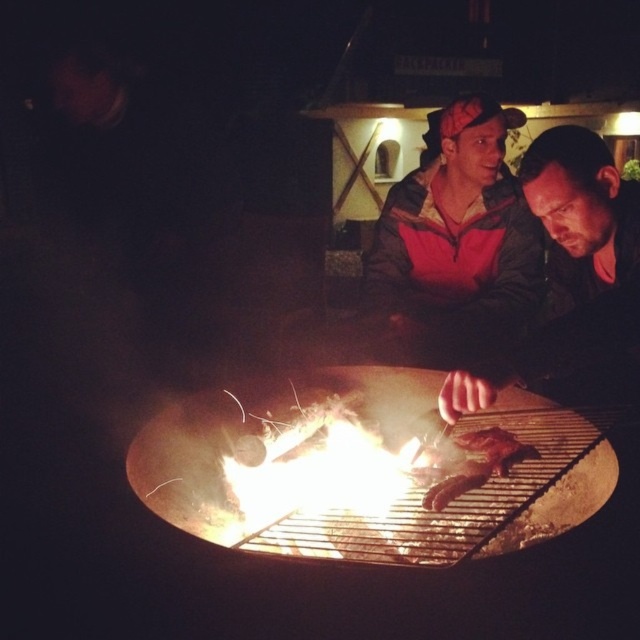
In the scene shown: You are standing near the fire pit and want to hand a marshmallow to the person in the camouflage jacket at center. Which side of the charred wood at grill center should you approach from to reach them?

The camouflage jacket at center is positioned on the right side of the charred wood at grill center, so you should approach from the right side of the charred wood at grill center to reach them.